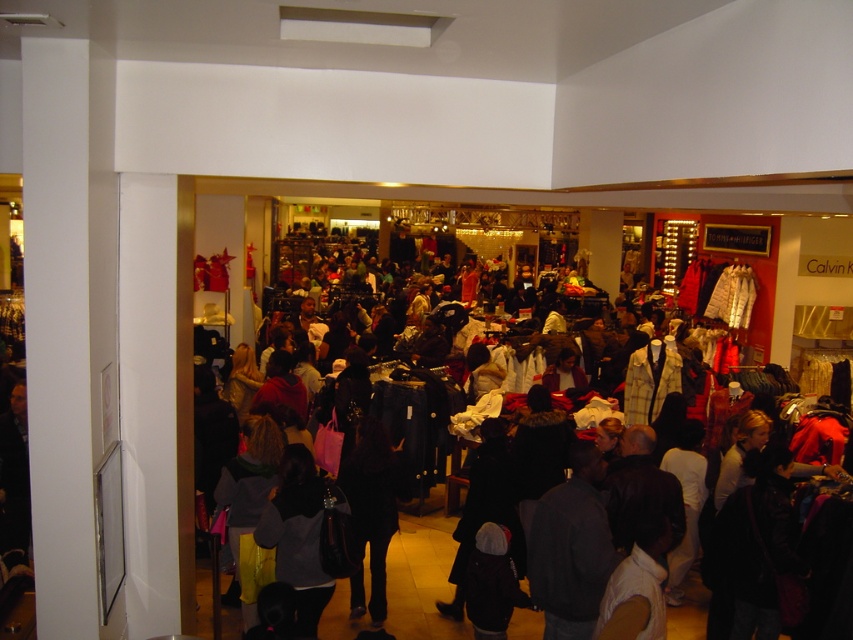
You are a store employee who needs to retrieve the light brown fabric shirt at lower right from the rack. The dark gray fabric jacket at center is blocking your path. Can you walk around it to reach the shirt?

The dark gray fabric jacket at center is further to the viewer than the light brown fabric shirt at lower right, so you can walk around it to reach the shirt.

You are a customer trying to reach the yellow plaid jacket at center in a busy department store. There is a dark gray fabric jacket at center blocking your view. Which jacket should you move first to access the one you want?

The dark gray fabric jacket at center is in front of the yellow plaid jacket at center, so you should move the dark gray fabric jacket at center first to access the yellow plaid jacket at center.